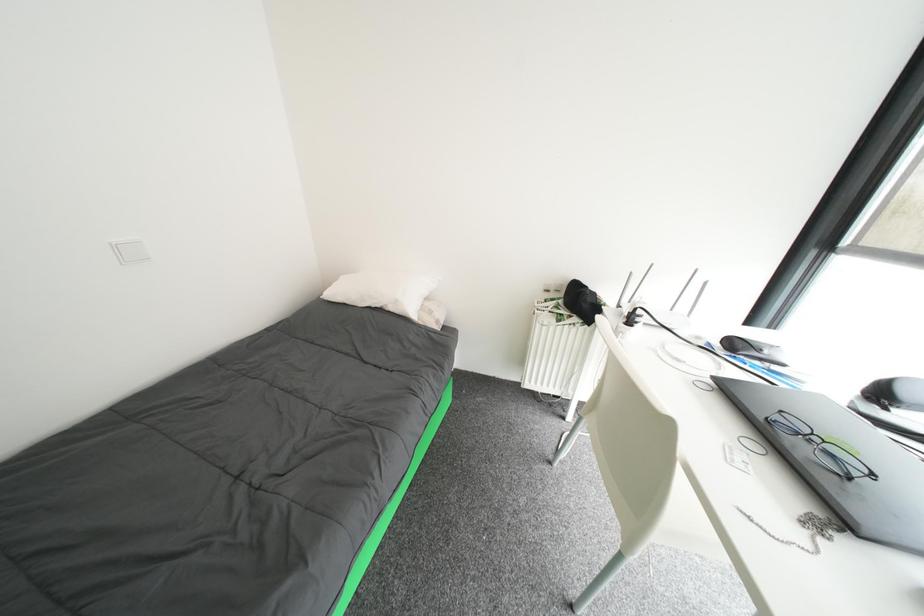
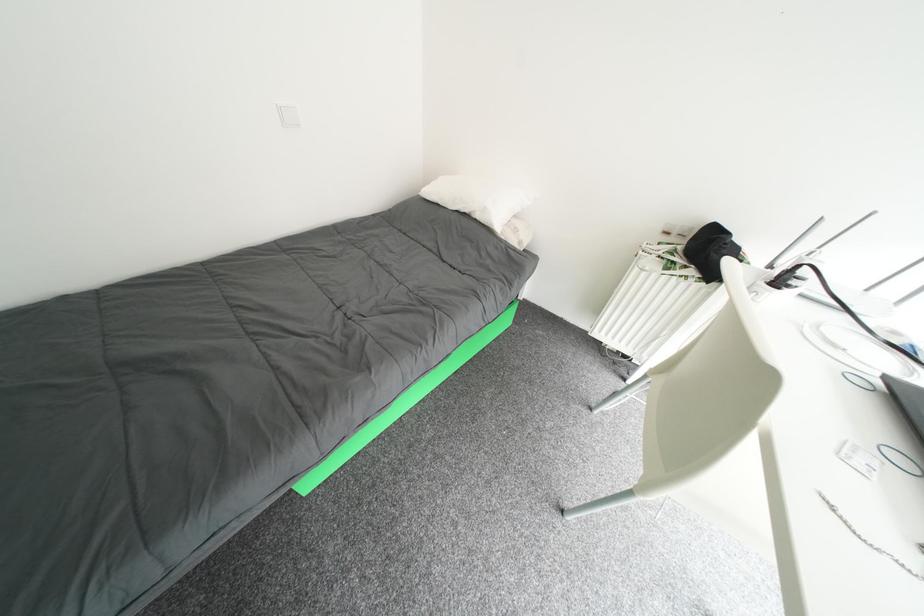
Looking at this image, based on the continuous images, in which direction is the camera rotating?

The rotation direction of the camera is left-down.